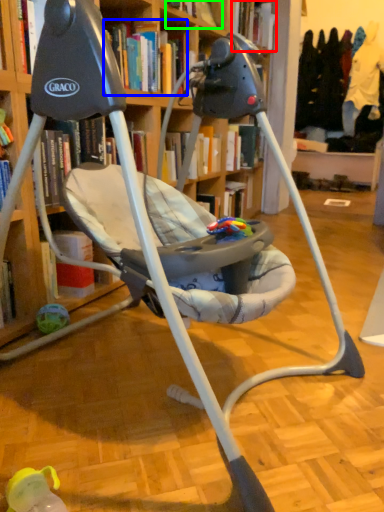
Question: Based on their relative distances, which object is nearer to book (highlighted by a red box)? Choose from book (highlighted by a blue box) and book (highlighted by a green box).

Choices:
 (A) book
 (B) book

Answer: (B)